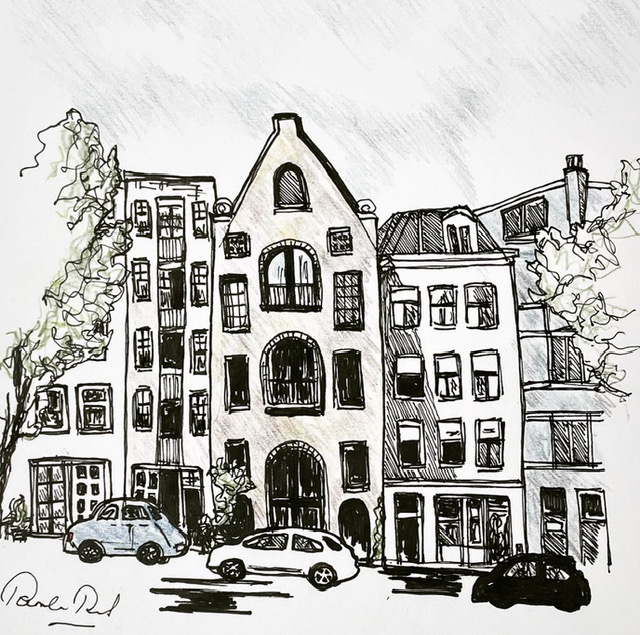
Image resolution: width=640 pixels, height=635 pixels. Identify the location of large door. (296, 502).